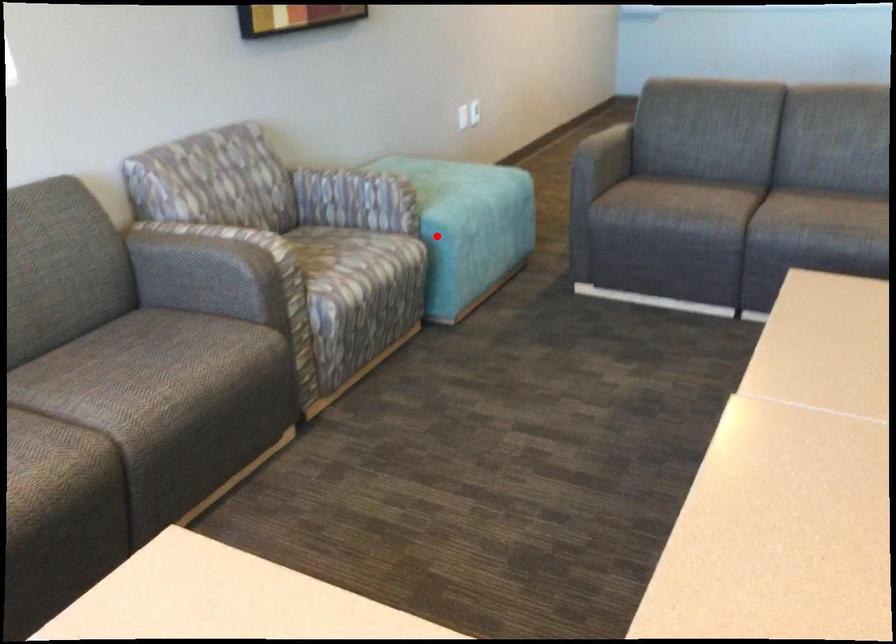
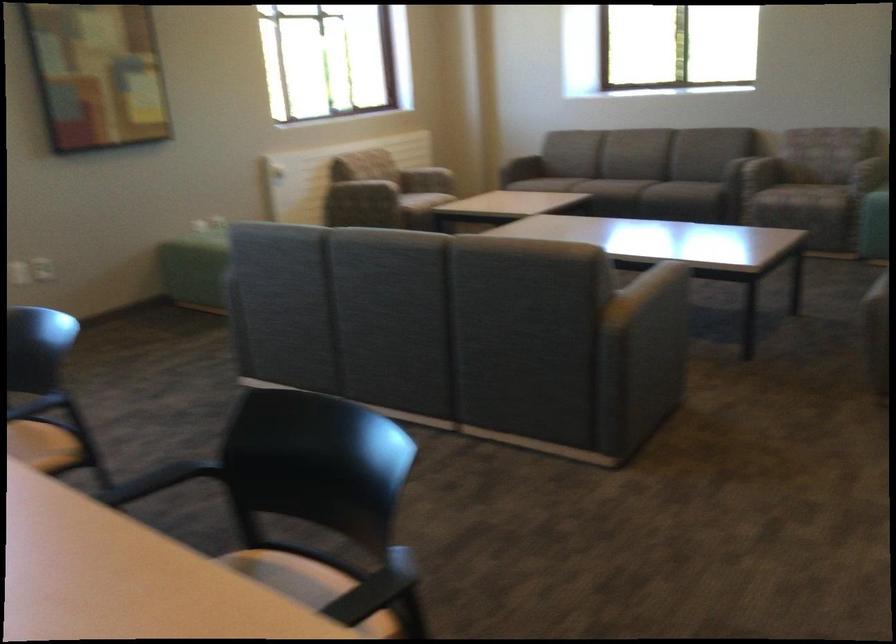
Locate, in the second image, the point that corresponds to the highlighted location in the first image.

(807, 184)